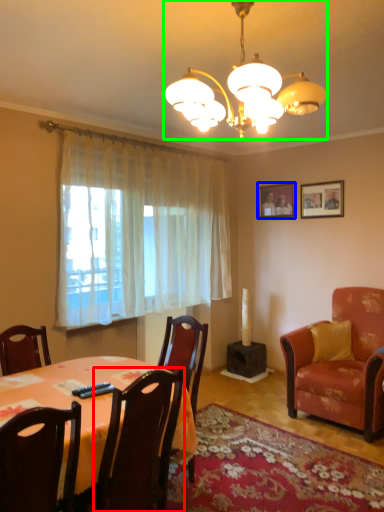
Question: Estimate the real-world distances between objects in this image. Which object is farther from chair (highlighted by a red box), picture frame (highlighted by a blue box) or lamp (highlighted by a green box)?

Choices:
 (A) picture frame
 (B) lamp

Answer: (A)